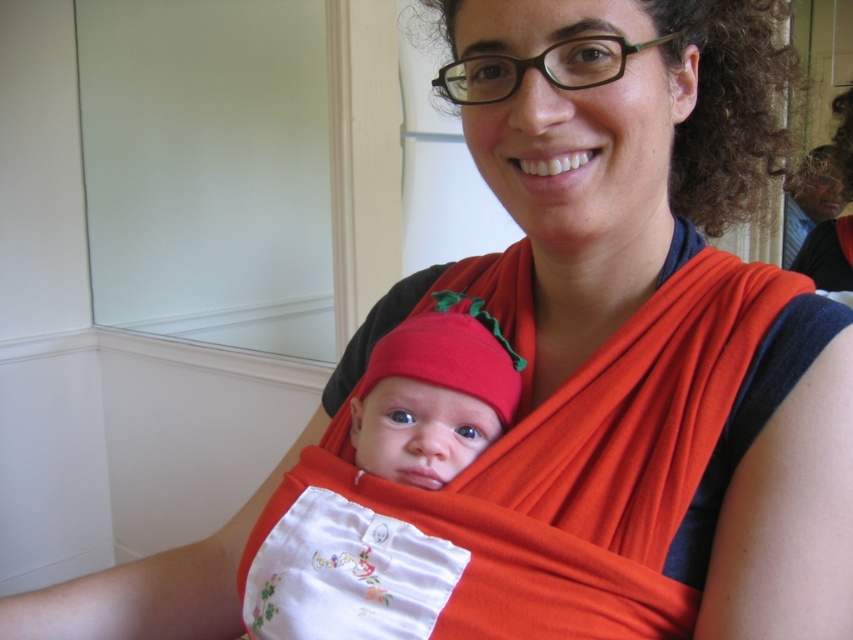
Is white embroidered bib at center positioned in front of matte red fabric baby at center?

Yes.

Does white embroidered bib at center appear over matte red fabric baby at center?

Actually, white embroidered bib at center is below matte red fabric baby at center.

Is point (628, 461) behind point (440, 413)?

No.

Where is `white embroidered bib at center`? Image resolution: width=853 pixels, height=640 pixels. white embroidered bib at center is located at coordinates (532, 483).